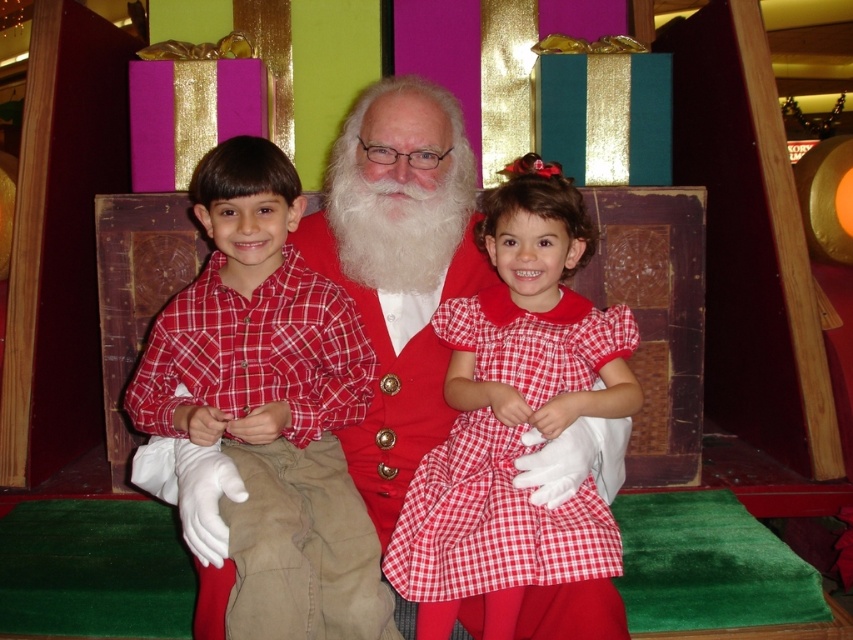
Measure the distance between red plaid shirt at center and camera.

red plaid shirt at center and camera are 5.05 feet apart from each other.

Is red plaid shirt at center in front of red checkered dress at center?

Yes, it is.

Who is more distant from viewer, (294, 195) or (625, 336)?

Point (294, 195)

The image size is (853, 640). In order to click on red plaid shirt at center in this screenshot , I will do click(x=270, y=406).